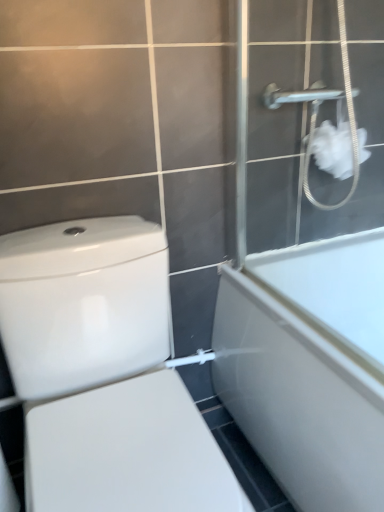
Question: Is white glossy toilet at lower left oriented towards white fluffy tissue at upper right?

Choices:
 (A) yes
 (B) no

Answer: (B)

Question: Is white fluffy tissue at upper right a part of white glossy toilet at lower left?

Choices:
 (A) no
 (B) yes

Answer: (A)

Question: Does white glossy toilet at lower left have a lesser width compared to white fluffy tissue at upper right?

Choices:
 (A) no
 (B) yes

Answer: (A)

Question: From a real-world perspective, is white glossy toilet at lower left positioned over white fluffy tissue at upper right based on gravity?

Choices:
 (A) no
 (B) yes

Answer: (A)

Question: Can you confirm if white glossy toilet at lower left is shorter than white fluffy tissue at upper right?

Choices:
 (A) no
 (B) yes

Answer: (A)

Question: Is white glossy toilet at lower left wider or thinner than white glossy bathtub at right?

Choices:
 (A) thin
 (B) wide

Answer: (A)

Question: Choose the correct answer: Is white glossy toilet at lower left inside white glossy bathtub at right or outside it?

Choices:
 (A) outside
 (B) inside

Answer: (A)

Question: Visually, is white glossy toilet at lower left positioned to the left or to the right of white glossy bathtub at right?

Choices:
 (A) right
 (B) left

Answer: (B)

Question: From their relative heights in the image, would you say white glossy toilet at lower left is taller or shorter than white glossy bathtub at right?

Choices:
 (A) tall
 (B) short

Answer: (A)

Question: Considering the positions of white matte shower screen at upper right and white glossy toilet at lower left in the image, is white matte shower screen at upper right bigger or smaller than white glossy toilet at lower left?

Choices:
 (A) small
 (B) big

Answer: (A)

Question: Visually, is white matte shower screen at upper right positioned to the left or to the right of white glossy toilet at lower left?

Choices:
 (A) left
 (B) right

Answer: (B)

Question: Choose the correct answer: Is white matte shower screen at upper right inside white glossy toilet at lower left or outside it?

Choices:
 (A) outside
 (B) inside

Answer: (A)

Question: From a real-world perspective, is white matte shower screen at upper right above or below white glossy toilet at lower left?

Choices:
 (A) below
 (B) above

Answer: (B)

Question: Is white matte shower screen at upper right in front of or behind white fluffy tissue at upper right in the image?

Choices:
 (A) front
 (B) behind

Answer: (A)

Question: In terms of width, does white matte shower screen at upper right look wider or thinner when compared to white fluffy tissue at upper right?

Choices:
 (A) thin
 (B) wide

Answer: (B)